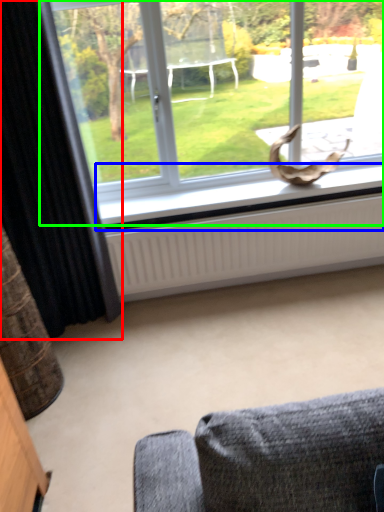
Question: Which object is the farthest from curtain (highlighted by a red box)? Choose among these: window sill (highlighted by a blue box) or window (highlighted by a green box).

Choices:
 (A) window sill
 (B) window

Answer: (B)